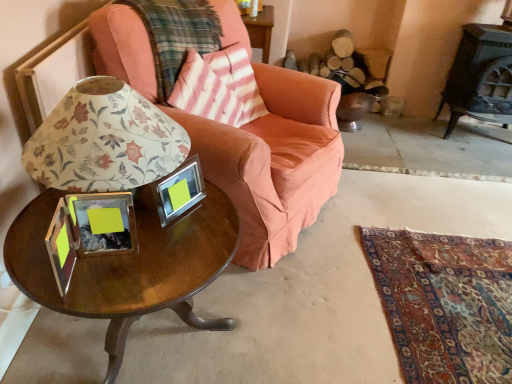
At what (x,y) coordinates should I click in order to perform the action: click on vacant space to the right of shiny brown wood coffee table at lower left. Please return your answer as a coordinate pair (x, y). Looking at the image, I should click on (308, 318).